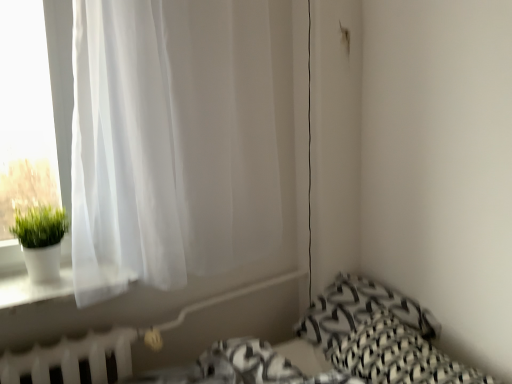
Question: Considering the relative sizes of white plastic radiator at lower left and black woven pillow at lower right, marked as the 2th pillow in a front-to-back arrangement, in the image provided, is white plastic radiator at lower left wider than black woven pillow at lower right, marked as the 2th pillow in a front-to-back arrangement,?

Choices:
 (A) no
 (B) yes

Answer: (A)

Question: From the image's perspective, is white plastic radiator at lower left on top of black woven pillow at lower right, marked as the 2th pillow in a front-to-back arrangement?

Choices:
 (A) yes
 (B) no

Answer: (B)

Question: Could you tell me if white plastic radiator at lower left is turned towards black woven pillow at lower right, marked as the 2th pillow in a front-to-back arrangement?

Choices:
 (A) no
 (B) yes

Answer: (A)

Question: Are white plastic radiator at lower left and black woven pillow at lower right, marked as the 2th pillow in a front-to-back arrangement, located far from each other?

Choices:
 (A) no
 (B) yes

Answer: (A)

Question: Can black woven pillow at lower right, marked as the 2th pillow in a front-to-back arrangement, be found inside white plastic radiator at lower left?

Choices:
 (A) yes
 (B) no

Answer: (B)

Question: From a real-world perspective, is white plastic radiator at lower left located beneath black woven pillow at lower right, marked as the 2th pillow in a front-to-back arrangement?

Choices:
 (A) yes
 (B) no

Answer: (A)

Question: From a real-world perspective, is black woven pillow at lower right, marked as the 2th pillow in a front-to-back arrangement, below white matte pot at left?

Choices:
 (A) yes
 (B) no

Answer: (A)

Question: Does black woven pillow at lower right, marked as the 2th pillow in a front-to-back arrangement, have a larger size compared to white matte pot at left?

Choices:
 (A) yes
 (B) no

Answer: (A)

Question: Does black woven pillow at lower right, acting as the first pillow starting from the back, have a lesser width compared to white matte pot at left?

Choices:
 (A) no
 (B) yes

Answer: (A)

Question: Does black woven pillow at lower right, marked as the 2th pillow in a front-to-back arrangement, have a smaller size compared to white matte pot at left?

Choices:
 (A) no
 (B) yes

Answer: (A)

Question: Is black woven pillow at lower right, marked as the 2th pillow in a front-to-back arrangement, outside white matte pot at left?

Choices:
 (A) no
 (B) yes

Answer: (B)

Question: Can you confirm if black woven pillow at lower right, acting as the first pillow starting from the back, is shorter than white matte pot at left?

Choices:
 (A) yes
 (B) no

Answer: (A)

Question: Does black woven pillow at lower right, the second pillow positioned from the back, have a greater width compared to white plastic radiator at lower left?

Choices:
 (A) no
 (B) yes

Answer: (B)